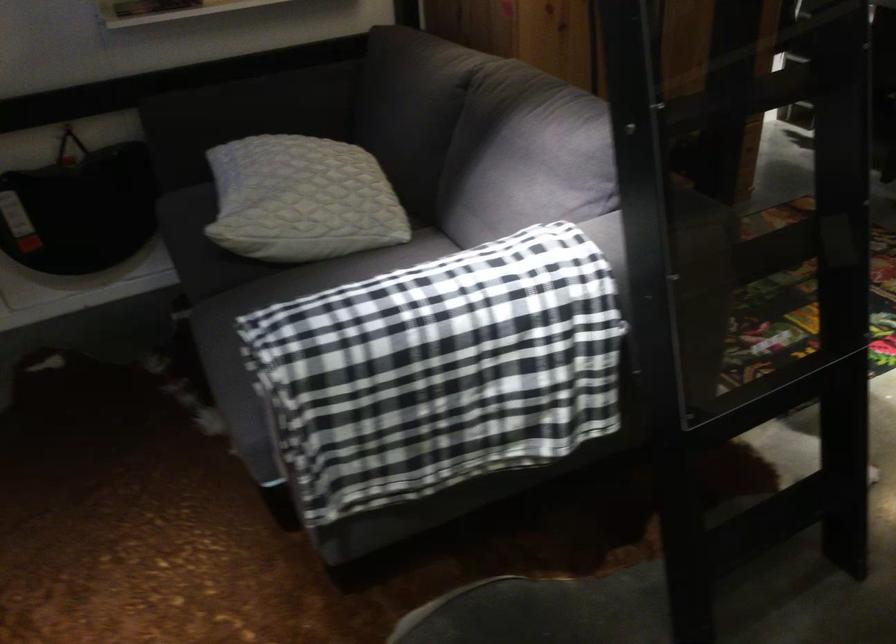
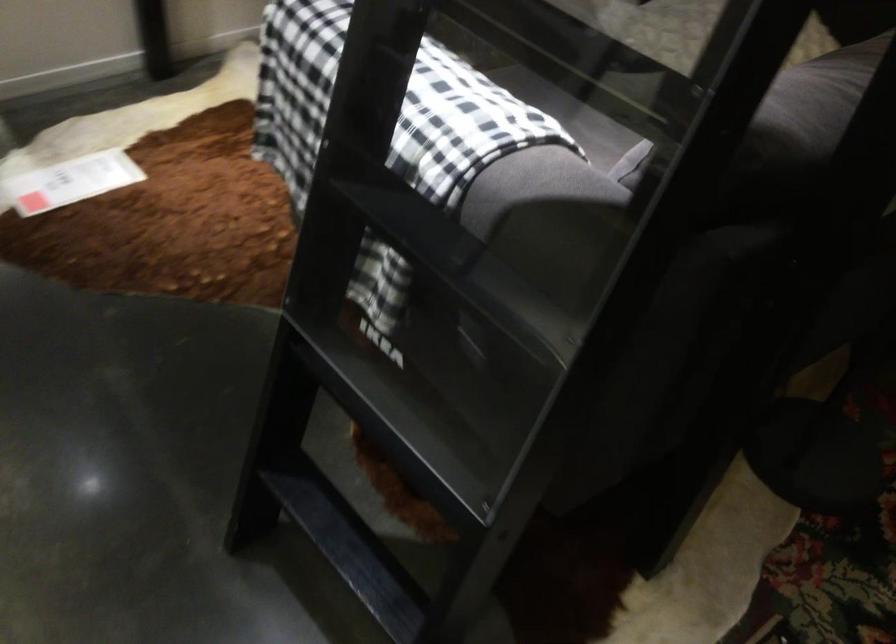
In the second image, find the point that corresponds to (x=643, y=239) in the first image.

(384, 107)